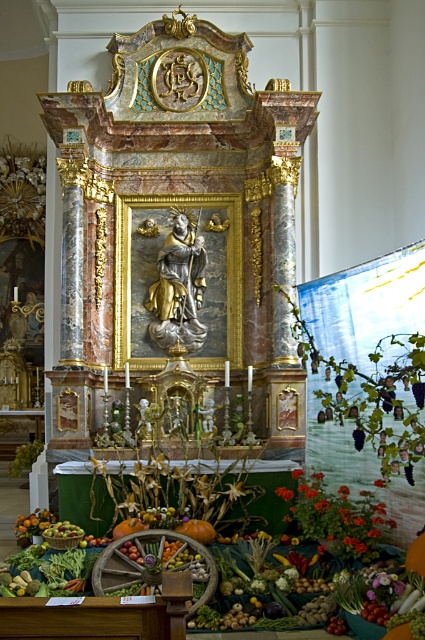
Is gold plated statue at center above smooth orange pumpkin at center?

Correct, gold plated statue at center is located above smooth orange pumpkin at center.

Is point (190, 230) farther from camera compared to point (121, 525)?

Yes, point (190, 230) is behind point (121, 525).

Find the location of a particular element. gold plated statue at center is located at coordinates (178, 285).

Between point (311, 474) and point (73, 536), which one is positioned in front?

Point (73, 536) is in front.

Between point (370, 520) and point (64, 520), which one is positioned behind?

Point (64, 520)

At what (x,y) coordinates should I click in order to perform the action: click on vibrant orange petals at center. Please return your answer as a coordinate pair (x, y). Looking at the image, I should click on click(339, 518).

Who is more forward, (x=306, y=490) or (x=116, y=525)?

Point (x=306, y=490)

Which is more to the left, vibrant orange petals at center or smooth orange pumpkin at center?

Positioned to the left is smooth orange pumpkin at center.

Does point (336, 518) lie in front of point (116, 529)?

Yes, it is.

Locate an element on the screen. The image size is (425, 640). vibrant orange petals at center is located at coordinates 339,518.